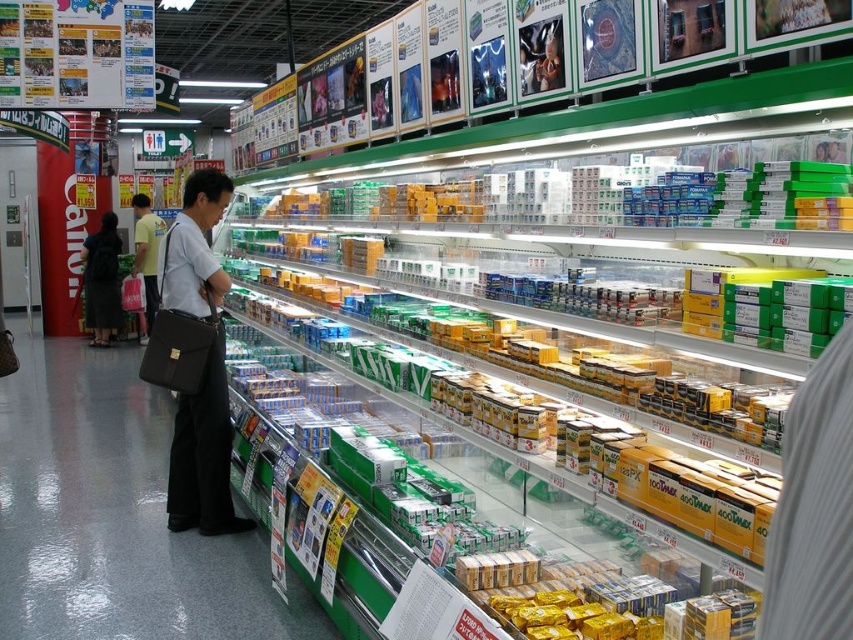
Question: Considering the real-world distances, which object is farthest from the light blue shirt at center?

Choices:
 (A) dark gray dress at center
 (B) matte black briefcase at center
 (C) dark gray fabric briefcase at center

Answer: (B)

Question: Is the position of dark gray fabric briefcase at center more distant than that of light blue shirt at center?

Choices:
 (A) yes
 (B) no

Answer: (B)

Question: Which object appears farthest from the camera in this image?

Choices:
 (A) dark gray dress at center
 (B) matte black briefcase at center

Answer: (A)

Question: Does dark gray fabric briefcase at center have a greater width compared to light blue shirt at center?

Choices:
 (A) yes
 (B) no

Answer: (B)

Question: Is dark gray dress at center smaller than light blue shirt at center?

Choices:
 (A) no
 (B) yes

Answer: (B)

Question: Which object appears farthest from the camera in this image?

Choices:
 (A) matte black briefcase at center
 (B) dark gray fabric briefcase at center

Answer: (B)